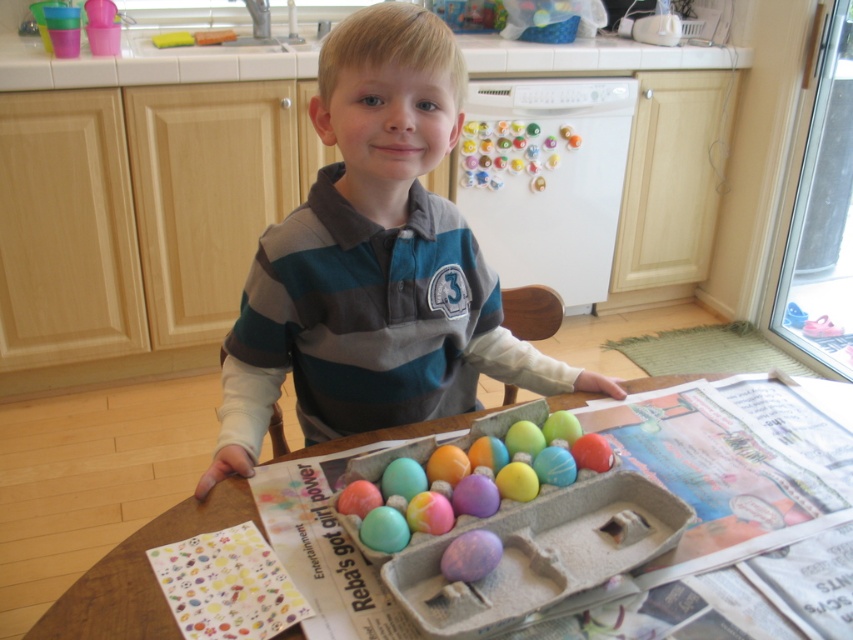
Question: Is striped cotton shirt at center bigger than cardboard tray at center?

Choices:
 (A) no
 (B) yes

Answer: (B)

Question: Is striped cotton shirt at center closer to camera compared to cardboard tray at center?

Choices:
 (A) no
 (B) yes

Answer: (A)

Question: Does pastel matte eggs at center appear under cardboard tray at center?

Choices:
 (A) no
 (B) yes

Answer: (A)

Question: Based on their relative distances, which object is farther from the pastel matte eggs at center?

Choices:
 (A) striped cotton shirt at center
 (B) cardboard tray at center

Answer: (A)

Question: Estimate the real-world distances between objects in this image. Which object is closer to the pastel matte eggs at center?

Choices:
 (A) cardboard tray at center
 (B) striped cotton shirt at center

Answer: (A)

Question: Estimate the real-world distances between objects in this image. Which object is closer to the cardboard tray at center?

Choices:
 (A) pastel matte eggs at center
 (B) striped cotton shirt at center

Answer: (A)